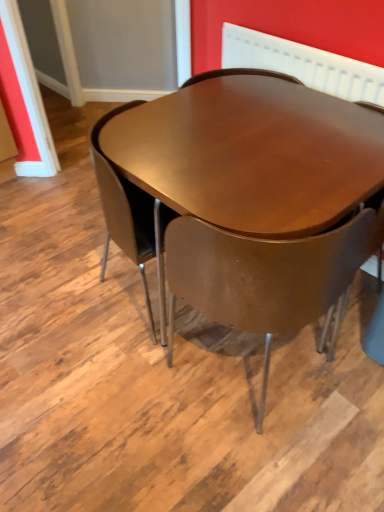
I want to click on free space on the front side of shiny brown table at center, so click(x=230, y=437).